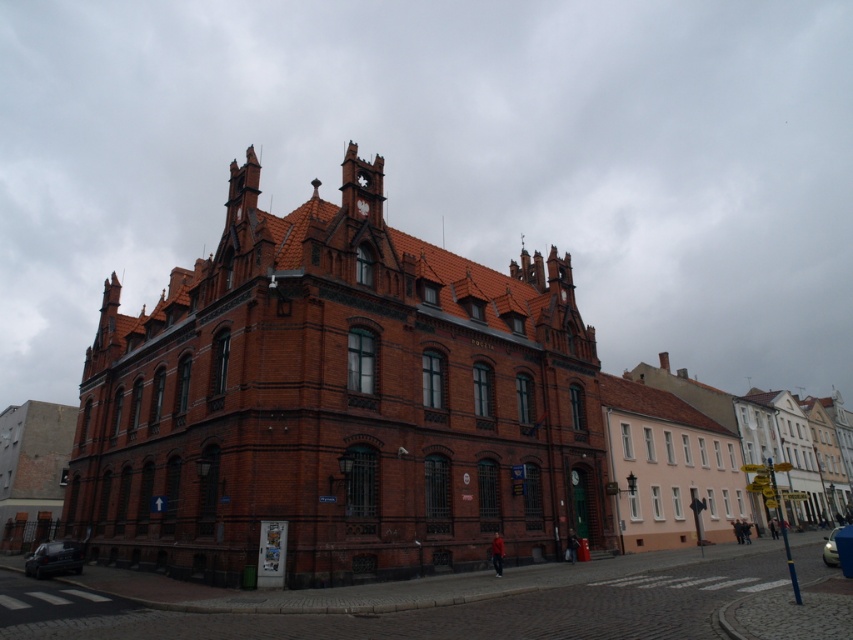
You are standing on the sidewalk in front of the red brick building and notice two clocks. The white glossy clock at upper center and the matte brown clock at center. Which clock is located to the left of the other?

The white glossy clock at upper center is positioned on the left side of the matte brown clock at center.

You are a pedestrian standing on the sidewalk in front of the red brick building. You see a shiny silver car at lower right and a matte brown clock at center. Which object is closer to you?

The shiny silver car at lower right is positioned under the matte brown clock at center, so it is closer to you.